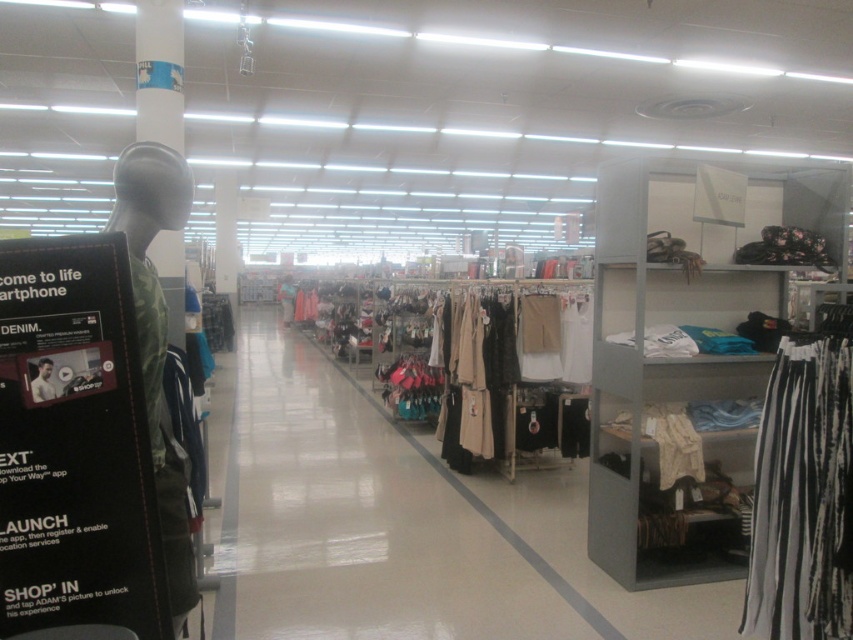
Question: Among these points, which one is nearest to the camera?

Choices:
 (A) (292, 284)
 (B) (416, 470)
 (C) (416, 381)
 (D) (718, 275)

Answer: (D)

Question: Which of the following is the farthest from the observer?

Choices:
 (A) light pink fabric dress at center
 (B) black striped skirt at lower right
 (C) matte beige dress at center

Answer: (A)

Question: Does metallic gray shelf at right appear on the right side of light pink fabric dress at center?

Choices:
 (A) yes
 (B) no

Answer: (A)

Question: Which point appears farthest from the camera in this image?

Choices:
 (A) coord(286,291)
 (B) coord(799,548)
 (C) coord(39,388)

Answer: (A)

Question: Is matte beige dress at center smaller than light pink fabric dress at center?

Choices:
 (A) yes
 (B) no

Answer: (B)

Question: Can you confirm if black striped skirt at lower right is smaller than white cotton shirt at center?

Choices:
 (A) yes
 (B) no

Answer: (B)